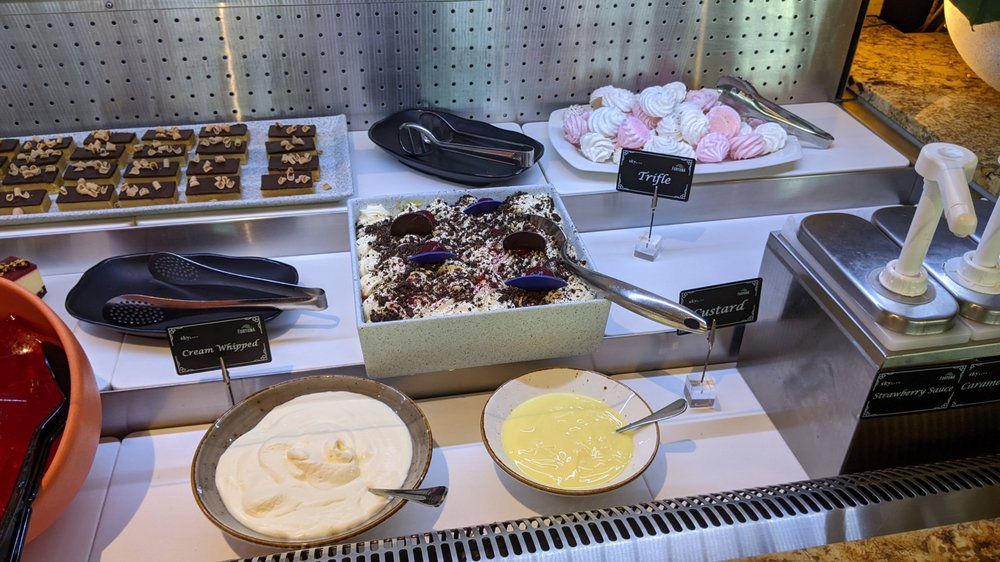
You are a GUI agent. You are given a task and a screenshot of the screen. Output one action in this format:
    pyautogui.click(x=<x>, y=<y>)
    Task: Click on the silver tray
    
    Given the screenshot: What is the action you would take?
    pyautogui.click(x=255, y=198)